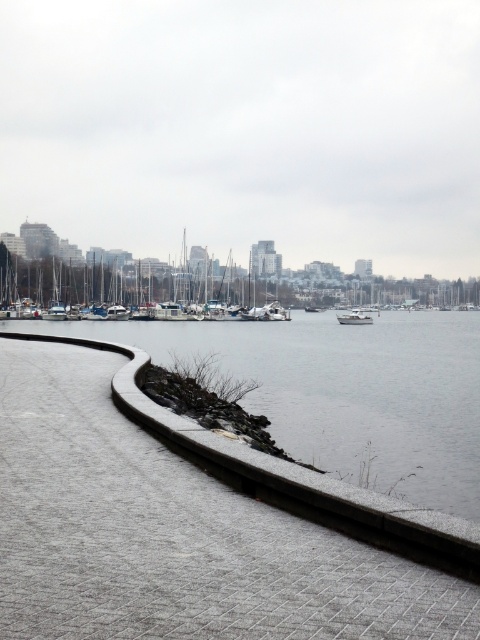
You are a photographer planning to capture the white matte sailboat at center and the gray concrete water at center in a single shot. Based on their positions, will the sailboat appear to be floating on the water? Explain your reasoning.

The gray concrete water at center is positioned under the white matte sailboat at center, so yes, the sailboat will appear to be floating on the water as it is placed directly above the water in the image.

You are standing on the paved pathway and want to take a photo of both the white matte sailboat at center and the white matte boat at center. Since they are both at the center, how can you ensure both are fully visible in your photo without one blocking the other?

The white matte boat at center is behind the white matte sailboat at center, so you can position yourself so the white matte sailboat at center is in front but not directly blocking the white matte boat at center, allowing both to be visible in the photo.

You are standing on the pathway and want to take a photo that includes both the gray concrete water at center and the white matte sailboat at center. Which object will appear larger in the photo?

The white matte sailboat at center will appear larger in the photo because it is larger than the gray concrete water at center.